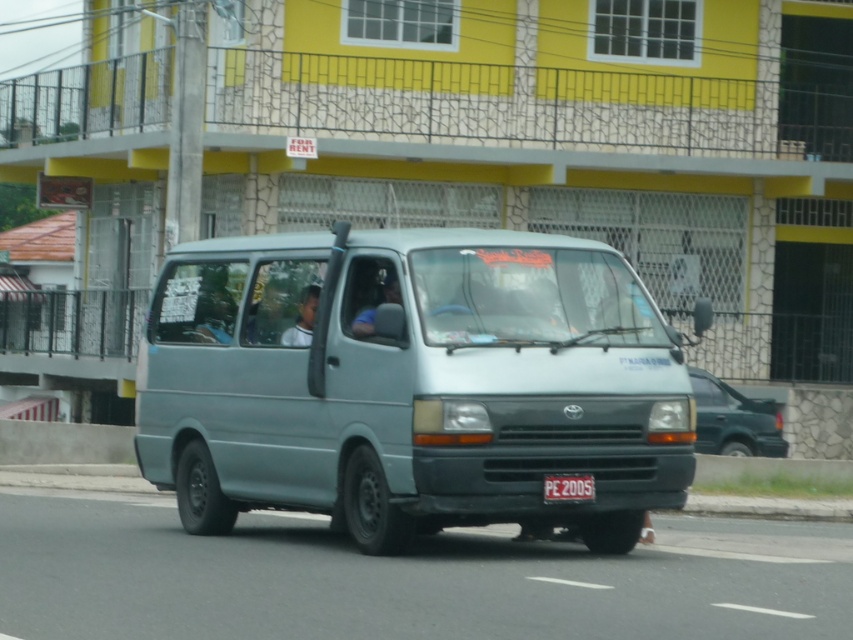
Question: Among these points, which one is nearest to the camera?

Choices:
 (A) (781, 420)
 (B) (548, 497)

Answer: (B)

Question: Is light blue matte van at center positioned in front of matte blue shirt at center?

Choices:
 (A) no
 (B) yes

Answer: (B)

Question: Which of these objects is positioned farthest from the matte blue shirt at center?

Choices:
 (A) light blue matte van at center
 (B) white plastic license plate at center
 (C) green matte suv at right

Answer: (C)

Question: Where is white plastic license plate at center located in relation to matte blue shirt at center in the image?

Choices:
 (A) below
 (B) above

Answer: (A)

Question: Which of the following is the farthest from the observer?

Choices:
 (A) green matte suv at right
 (B) matte blue shirt at center

Answer: (A)

Question: Does light blue matte van at center have a larger size compared to green matte suv at right?

Choices:
 (A) no
 (B) yes

Answer: (B)